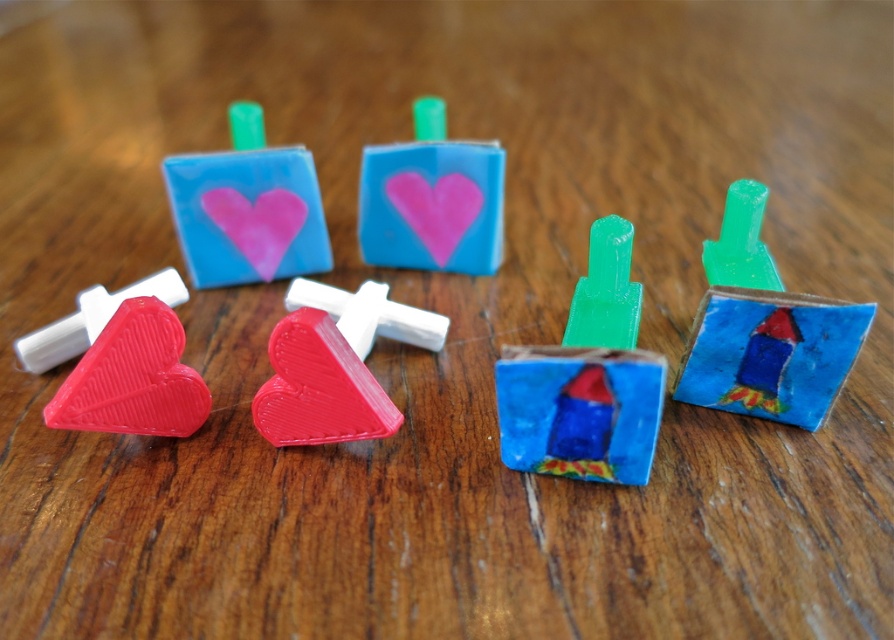
Question: Can you confirm if matte pink heart at center is bigger than pink matte heart at center?

Choices:
 (A) no
 (B) yes

Answer: (A)

Question: Does matte plastic heart at center appear on the left side of matte pink heart at center?

Choices:
 (A) no
 (B) yes

Answer: (A)

Question: Can you confirm if matte red heart at lower left is positioned to the right of matte plastic heart at center?

Choices:
 (A) no
 (B) yes

Answer: (A)

Question: Which point is farther from the camera taking this photo?

Choices:
 (A) (108, 412)
 (B) (283, 380)

Answer: (B)

Question: Which is nearer to the pink matte heart at center?

Choices:
 (A) matte pink heart at center
 (B) matte plastic heart at center
 (C) matte red heart at lower left

Answer: (A)

Question: Among these points, which one is nearest to the camera?

Choices:
 (A) (302, 326)
 (B) (305, 204)
 (C) (424, 205)

Answer: (A)